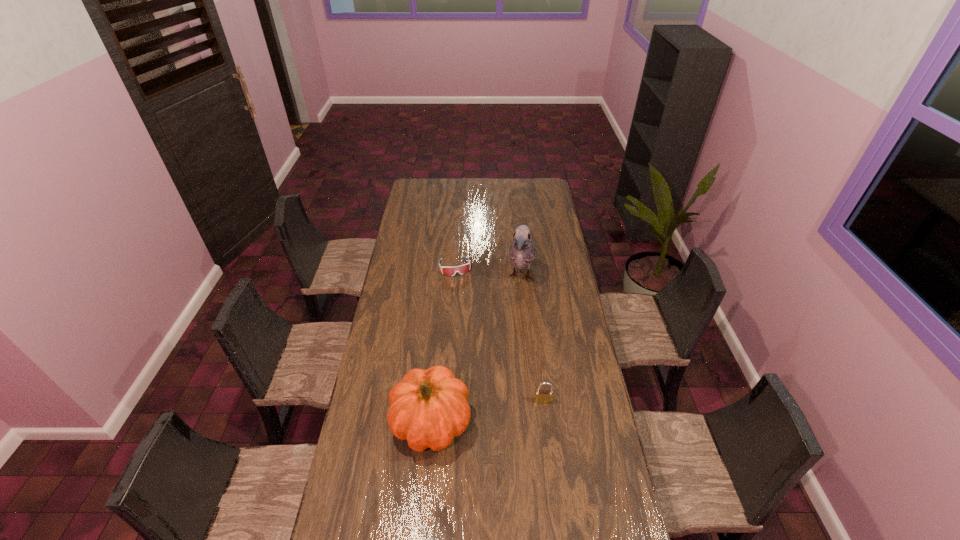
This screenshot has height=540, width=960. I want to click on vacant space on the desktop that is between the pumpkin and the padlock and is positioned on the front-facing side of the tallest object, so click(x=491, y=411).

You are a GUI agent. You are given a task and a screenshot of the screen. Output one action in this format:
    pyautogui.click(x=<x>, y=<y>)
    Task: Click on the free spot on the desktop that is between the pumpkin and the third tallest object and is positioned on the front-facing side of the shortest object
    This screenshot has height=540, width=960.
    Given the screenshot: What is the action you would take?
    pyautogui.click(x=494, y=410)